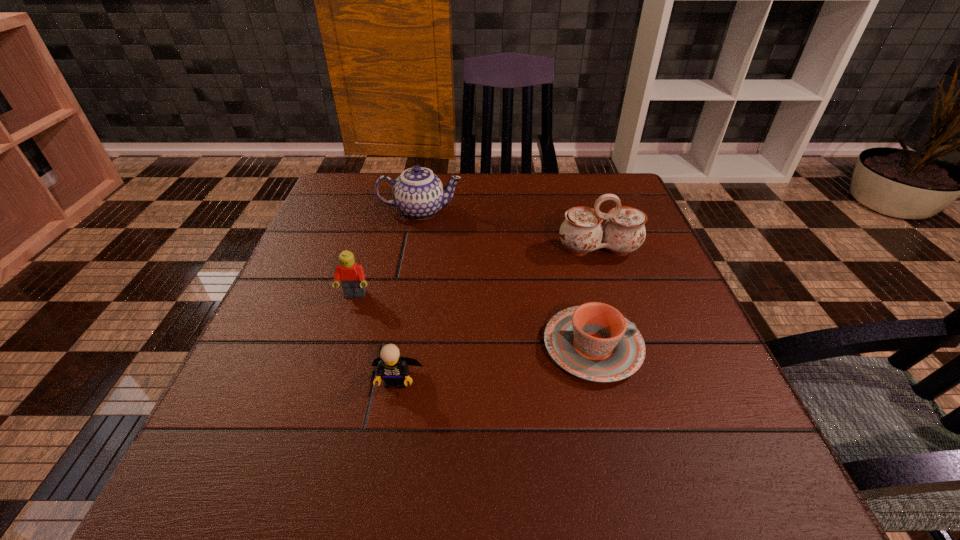
Identify the location of the second farthest chinaware. Image resolution: width=960 pixels, height=540 pixels. (581, 232).

Locate an element on the screen. The image size is (960, 540). the leftmost chinaware is located at coordinates (418, 193).

Locate an element on the screen. The width and height of the screenshot is (960, 540). the farthest chinaware is located at coordinates (418, 193).

Locate an element on the screen. the taller Lego is located at coordinates (351, 275).

Where is `the third tallest object`? The image size is (960, 540). the third tallest object is located at coordinates (351, 275).

At what (x,y) coordinates should I click in order to perform the action: click on the nearer Lego. Please return your answer as a coordinate pair (x, y). Looking at the image, I should click on (390, 366).

What are the coordinates of `the second shortest object` in the screenshot? It's located at (390, 366).

Image resolution: width=960 pixels, height=540 pixels. In order to click on the shortest chinaware in this screenshot , I will do `click(594, 341)`.

This screenshot has height=540, width=960. What are the coordinates of `the shortest object` in the screenshot? It's located at (594, 341).

Find the location of a particular element. The height and width of the screenshot is (540, 960). vacant space situated by the handle of the second farthest chinaware is located at coordinates (615, 300).